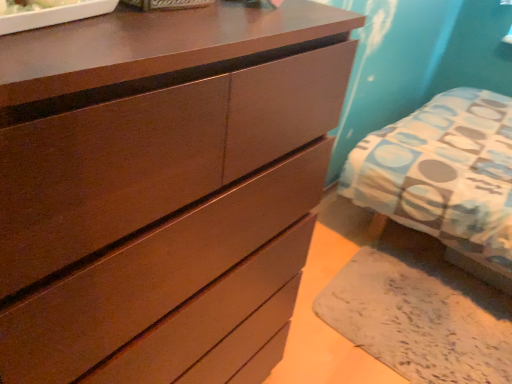
Locate an element on the screen. The width and height of the screenshot is (512, 384). matte brown dresser at center is located at coordinates (162, 188).

What do you see at coordinates (162, 188) in the screenshot? I see `matte brown dresser at center` at bounding box center [162, 188].

Measure the distance between matte brown dresser at center and camera.

matte brown dresser at center and camera are 15.58 inches apart.

The height and width of the screenshot is (384, 512). In order to click on matte brown dresser at center in this screenshot , I will do `click(162, 188)`.